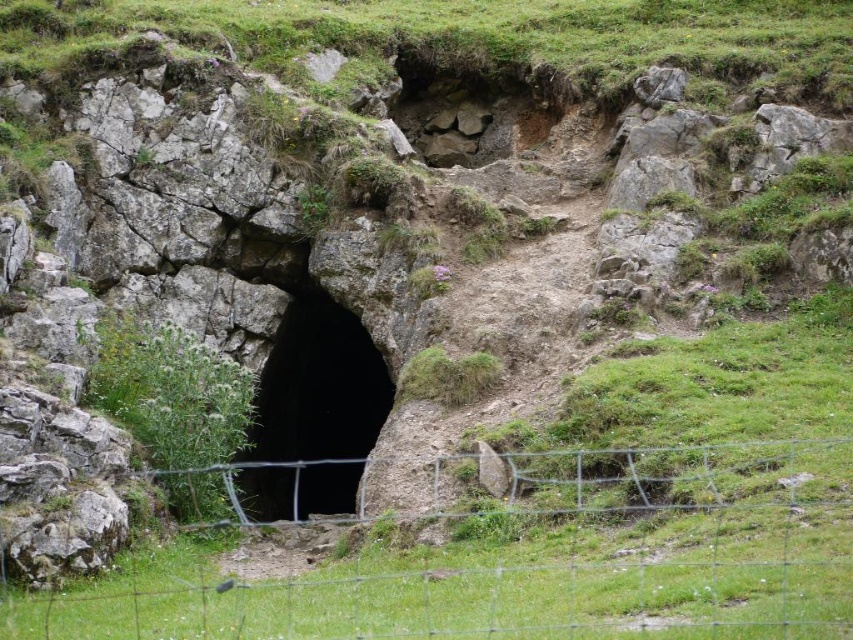
Question: Can you confirm if green grassy at upper center is positioned to the right of black rock hole at center?

Choices:
 (A) no
 (B) yes

Answer: (B)

Question: Which point is closer to the camera?

Choices:
 (A) black rock hole at center
 (B) wire mesh fence at center

Answer: (B)

Question: Which object is positioned farthest from the black rock hole at center?

Choices:
 (A) wire mesh fence at center
 (B) green grassy at upper center

Answer: (A)

Question: Which object appears farthest from the camera in this image?

Choices:
 (A) black rock hole at center
 (B) wire mesh fence at center

Answer: (A)

Question: Where is green grassy at upper center located in relation to black rock hole at center in the image?

Choices:
 (A) above
 (B) below

Answer: (A)

Question: Can you confirm if wire mesh fence at center is positioned to the left of green grassy at upper center?

Choices:
 (A) no
 (B) yes

Answer: (B)